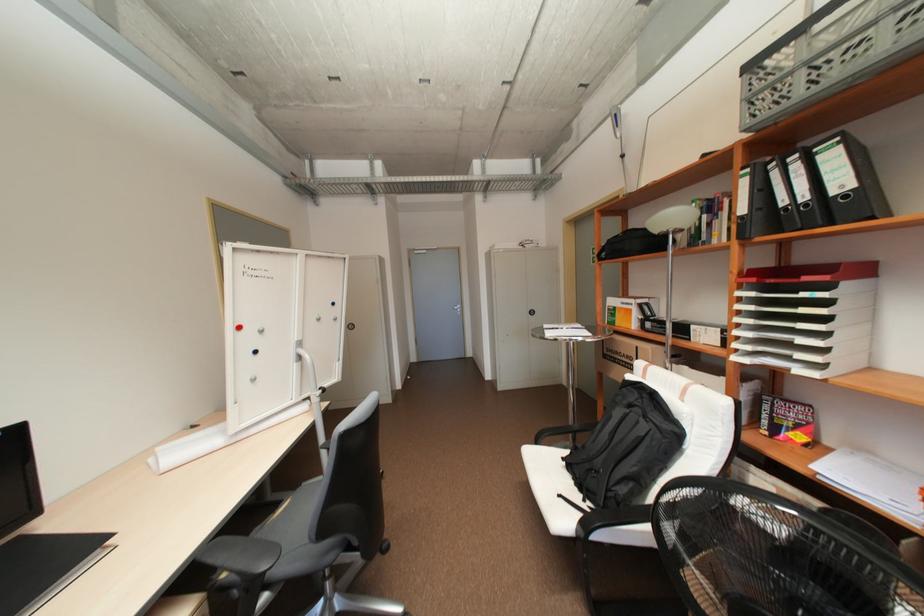
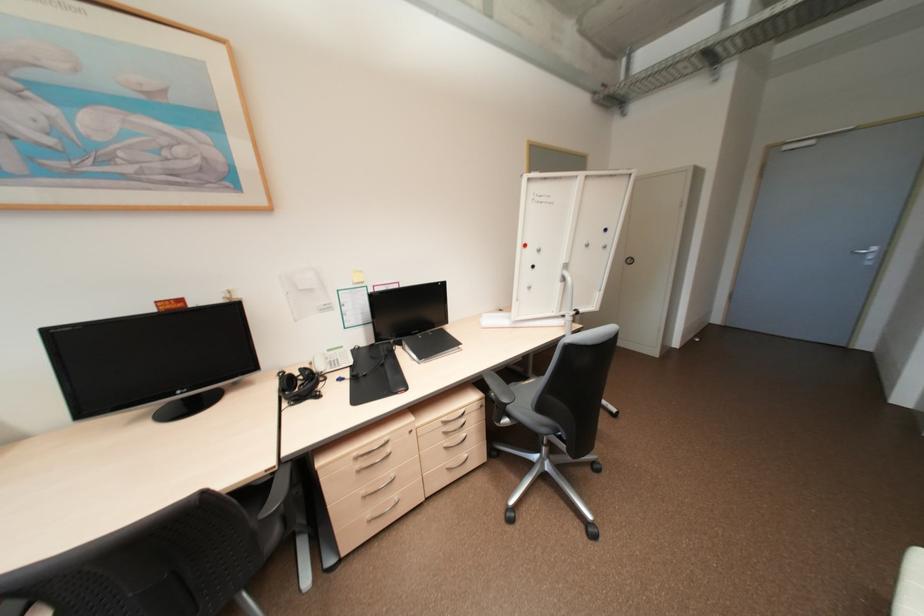
The point at (246,328) is marked in the first image. Where is the corresponding point in the second image?

(530, 245)